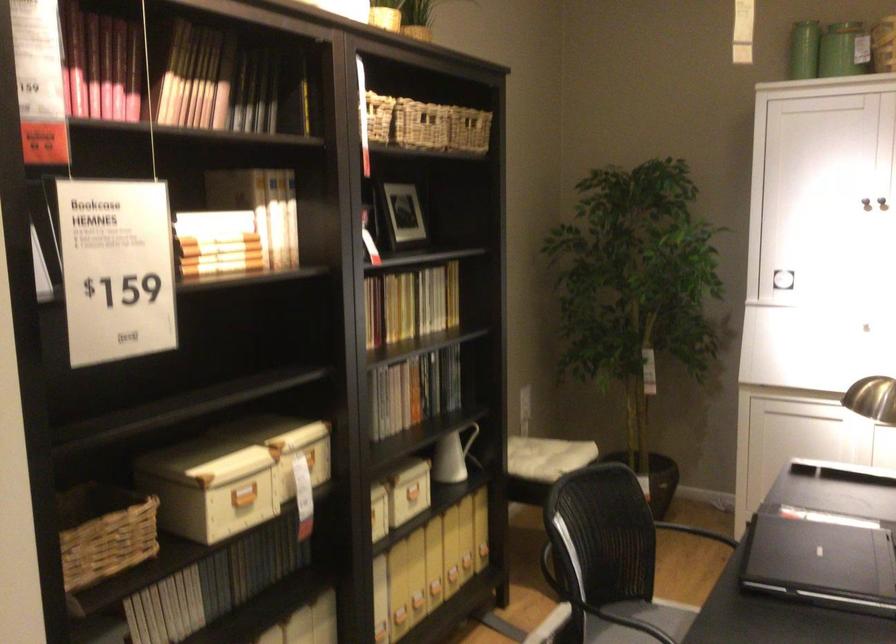
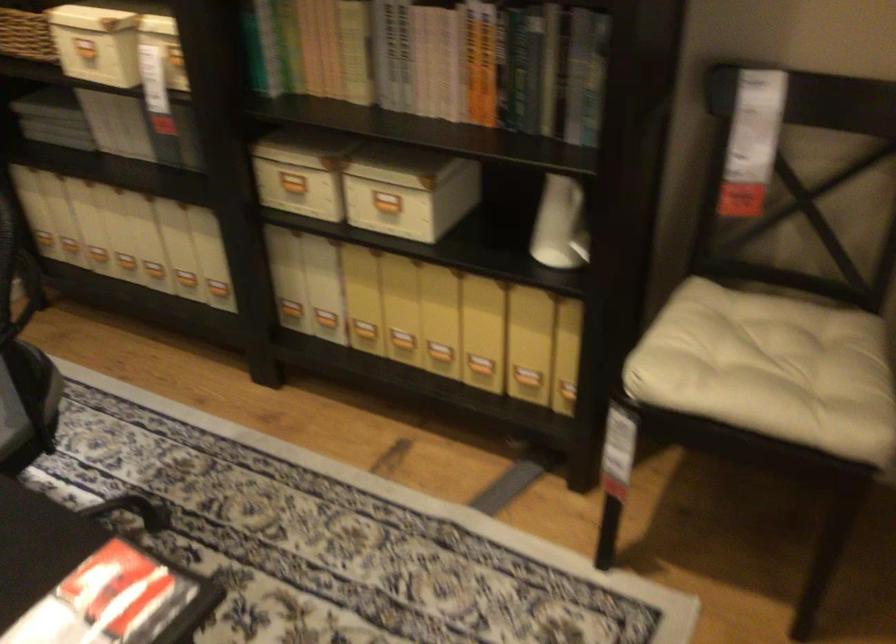
Where in the second image is the point corresponding to point (392, 395) from the first image?

(483, 62)